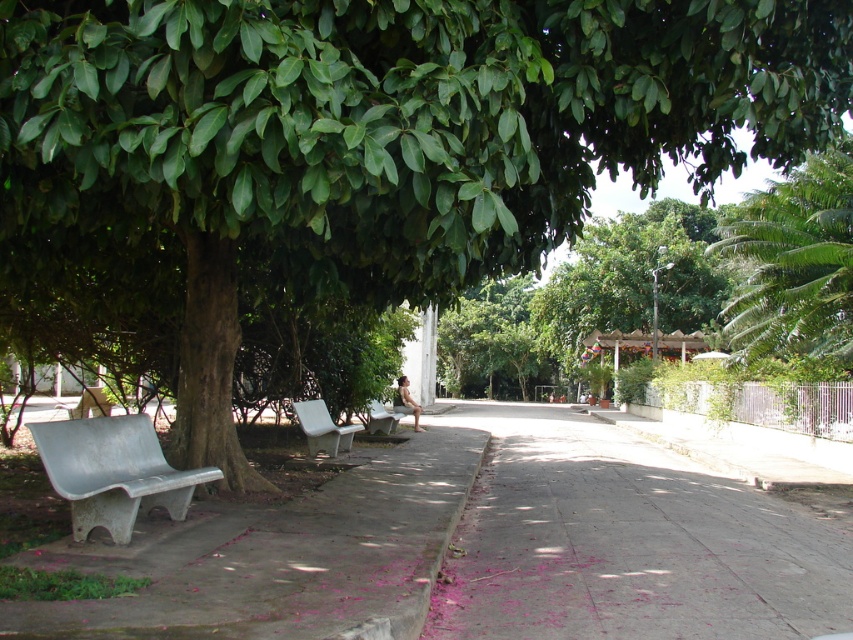
Based on the photo, you are a photographer standing at the starting point of the pathway. You want to take a photo that includes both point A at point (618, 460) and point B at point (120, 516). Which point should you focus on first to ensure both are in sharp focus?

You should focus on point A at point (618, 460) first because it is closer to the camera than point B at point (120, 516). This ensures that both points will be within the depth of field when focused on the closer object.

In the scene shown: You are standing at the point marked as point (627,541) on the gray concrete pavement at center. Looking around, you see two white benches on the left side of the path. Which direction should you walk to reach the nearest bench?

The nearest bench is the one closer to the viewer on the left side of the path. Since you are at point (627,541) on the gray concrete pavement at center, you should walk towards the left side of the path towards the nearest bench.

Looking at this image, you are standing at the starting point of the pathway in the park. You see two points marked on the path ahead of you, labeled as point (x=68, y=433) and point (x=323, y=413). Which point is closer to your current position?

Point (x=68, y=433) is in front of point (x=323, y=413), so it is closer to your current position.